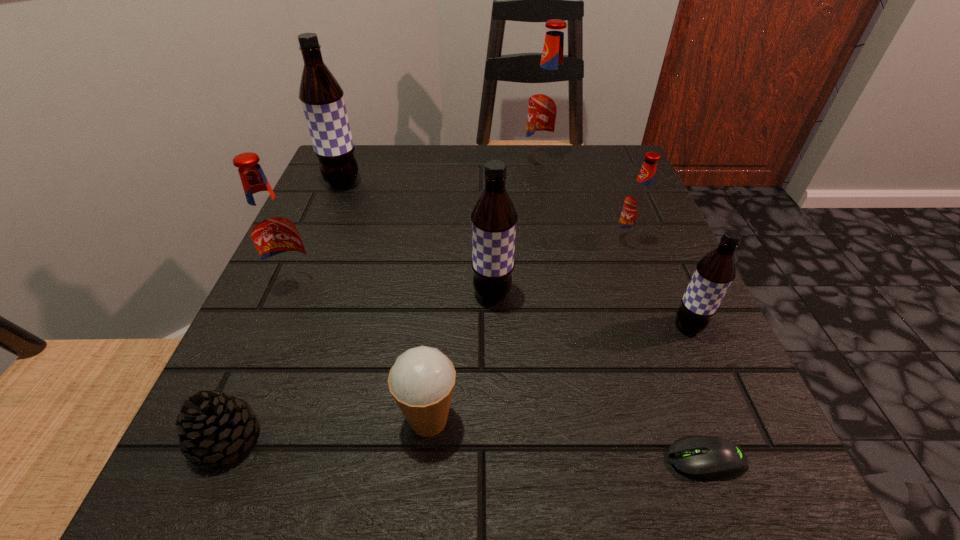
At what (x,y) coordinates should I click in order to perform the action: click on the rightmost brown root beer. Please return your answer as a coordinate pair (x, y). Image resolution: width=960 pixels, height=540 pixels. Looking at the image, I should click on (714, 273).

The height and width of the screenshot is (540, 960). Identify the location of the nearest root beer. (714, 273).

Find the location of a particular element. the third shortest object is located at coordinates (421, 381).

This screenshot has height=540, width=960. Identify the location of the sixth object from right to left. (421, 381).

Where is `pinecone`? This screenshot has width=960, height=540. pinecone is located at coordinates (211, 427).

Image resolution: width=960 pixels, height=540 pixels. I want to click on the shortest object, so (x=705, y=457).

Where is `computer mouse`? computer mouse is located at coordinates (705, 457).

Locate an element on the screen. The width and height of the screenshot is (960, 540). vacant space located on the left of the farthest object is located at coordinates (405, 162).

Locate an element on the screen. blank area located on the front of the biggest brown root beer is located at coordinates click(299, 291).

Find the location of a particular element. The image size is (960, 540). vacant point located on the front of the second farthest brown root beer is located at coordinates (496, 457).